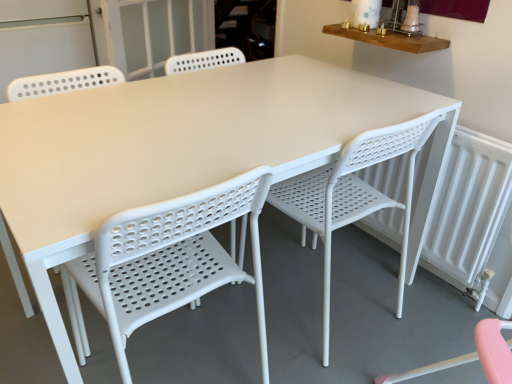
You are a GUI agent. You are given a task and a screenshot of the screen. Output one action in this format:
    pyautogui.click(x=<x>, y=<y>)
    Task: Click on the free location to the right of white plastic chair at center, placed as the 1th chair when sorted from right to left
    The width and height of the screenshot is (512, 384).
    Given the screenshot: What is the action you would take?
    pyautogui.click(x=412, y=309)